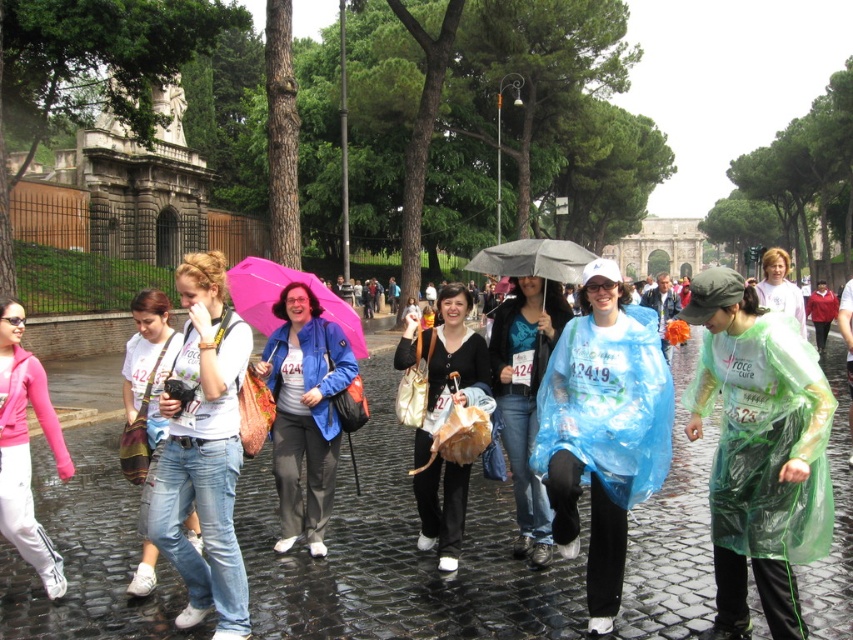
Question: Which point is closer to the camera?

Choices:
 (A) (146, 570)
 (B) (3, 422)
 (C) (793, 456)
 (D) (454, 323)

Answer: (C)

Question: Which point is closer to the camera taking this photo?

Choices:
 (A) (468, 365)
 (B) (566, 269)

Answer: (B)

Question: Where is transparent plastic raincoat at center located in relation to matte blue jacket at center in the image?

Choices:
 (A) right
 (B) left

Answer: (A)

Question: Is blue translucent raincoat at center below white cotton t-shirt at center?

Choices:
 (A) no
 (B) yes

Answer: (A)

Question: Can you confirm if pink fleece jacket at lower left is positioned below light green plastic poncho at center?

Choices:
 (A) no
 (B) yes

Answer: (B)

Question: Estimate the real-world distances between objects in this image. Which object is farther from the blue translucent raincoat at center?

Choices:
 (A) matte blue jacket at center
 (B) pink fabric umbrella at center
 (C) pink fleece jacket at lower left
 (D) transparent plastic raincoat at center

Answer: (C)